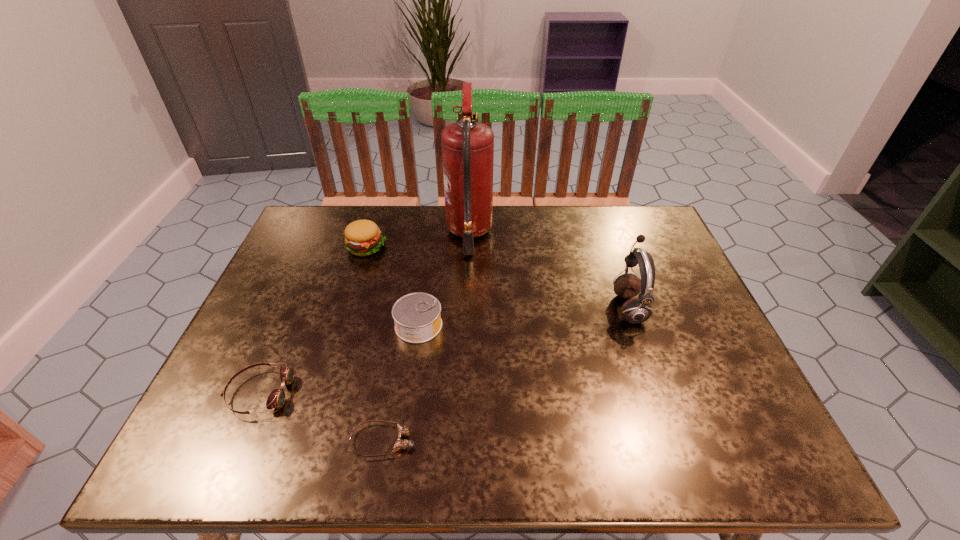
Where is `fire extinguisher`? Image resolution: width=960 pixels, height=540 pixels. fire extinguisher is located at coordinates (467, 146).

Find the location of a particular element. This screenshot has height=540, width=960. earphone is located at coordinates (636, 310).

Where is `the rightmost object`? The image size is (960, 540). the rightmost object is located at coordinates (636, 310).

At what (x,y) coordinates should I click in order to perform the action: click on the second object from left to right. Please return your answer as a coordinate pair (x, y). This screenshot has width=960, height=540. Looking at the image, I should click on (362, 237).

Find the location of a particular element. The image size is (960, 540). the fourth shortest object is located at coordinates (362, 237).

Locate an element on the screen. This screenshot has width=960, height=540. can is located at coordinates coord(417,316).

Find the location of a particular element. The width and height of the screenshot is (960, 540). the farther goggles is located at coordinates (276, 399).

The width and height of the screenshot is (960, 540). I want to click on the second nearest object, so click(276, 399).

The height and width of the screenshot is (540, 960). Identify the location of the shorter goggles. click(x=400, y=444).

This screenshot has width=960, height=540. I want to click on the shortest object, so click(400, 444).